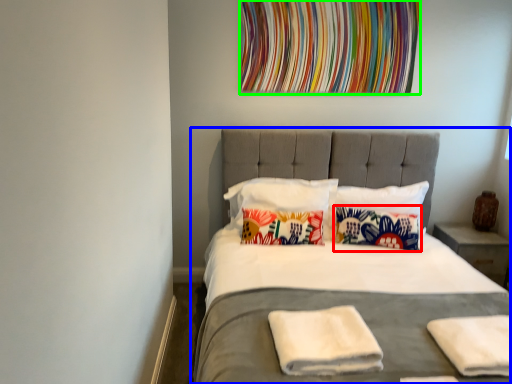
Question: Considering the real-world distances, which object is farthest from pillow (highlighted by a red box)? bed (highlighted by a blue box) or tapestry (highlighted by a green box)?

Choices:
 (A) bed
 (B) tapestry

Answer: (B)